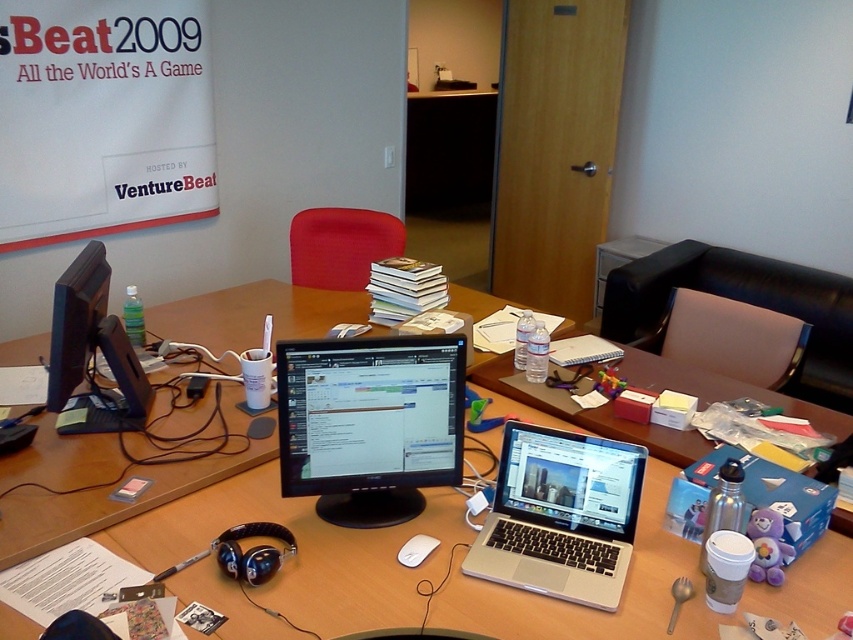
Question: Which point is farther from the camera taking this photo?

Choices:
 (A) (47, 225)
 (B) (425, 547)
 (C) (439, 573)
 (D) (84, 266)

Answer: (A)

Question: Observing the image, what is the correct spatial positioning of wooden table at center in reference to silver metallic laptop at center?

Choices:
 (A) right
 (B) left

Answer: (B)

Question: From the image, what is the correct spatial relationship of wooden table at center in relation to white paperboard at upper left?

Choices:
 (A) left
 (B) right

Answer: (B)

Question: Is silver metallic laptop at center above black glossy monitor at left?

Choices:
 (A) no
 (B) yes

Answer: (A)

Question: Which point is closer to the camera?

Choices:
 (A) white matte mouse at center
 (B) white paperboard at upper left
 (C) black glossy monitor at left
 (D) silver metallic laptop at center

Answer: (D)

Question: Which point is farther to the camera?

Choices:
 (A) (440, 609)
 (B) (532, 518)

Answer: (B)